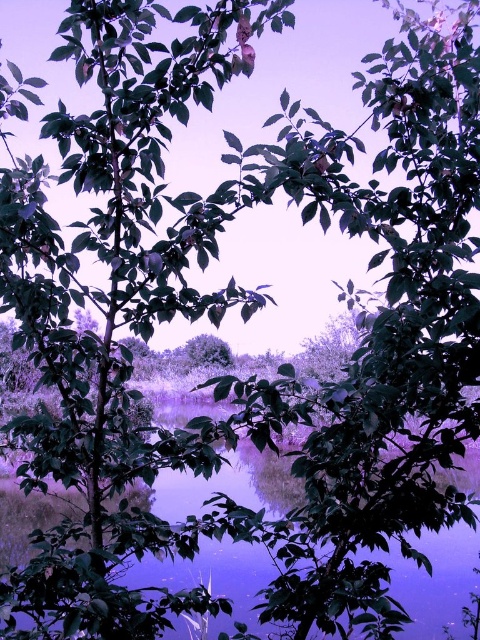
Question: Can you confirm if purple reflective water at center is bigger than green matte tree at center?

Choices:
 (A) yes
 (B) no

Answer: (A)

Question: Among these points, which one is farthest from the camera?

Choices:
 (A) (431, 595)
 (B) (226, 355)

Answer: (B)

Question: Is purple reflective water at center in front of green matte tree at center?

Choices:
 (A) yes
 (B) no

Answer: (A)

Question: Does purple reflective water at center appear on the right side of green matte tree at center?

Choices:
 (A) yes
 (B) no

Answer: (A)

Question: Among these points, which one is farthest from the camera?

Choices:
 (A) (279, 506)
 (B) (228, 364)

Answer: (B)